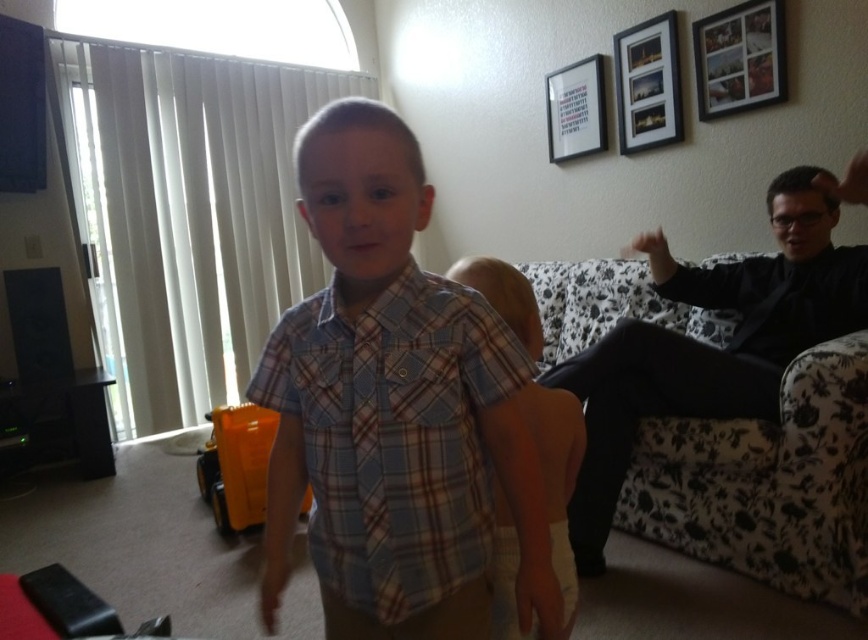
You are a photographer setting up a shoot in this living room. You need to place a new camera stand between the wooden picture frame at upper right and the white matte picture frame at upper center. Based on their positions, which frame is closer to you so you can position the stand appropriately?

The wooden picture frame at upper right is closer to the viewer than the white matte picture frame at upper center, so you should position the camera stand closer to the wooden picture frame at upper right.

In the scene shown: You are hanging two frames on a wall. The wooden picture frame at upper right and the white matte picture frame at upper center need to be placed such that the larger one is on the right side. Is the current arrangement correct?

Yes, the current arrangement is correct because the wooden picture frame at upper right has a larger size compared to the white matte picture frame at upper center, so the larger one is already positioned on the right side as required.